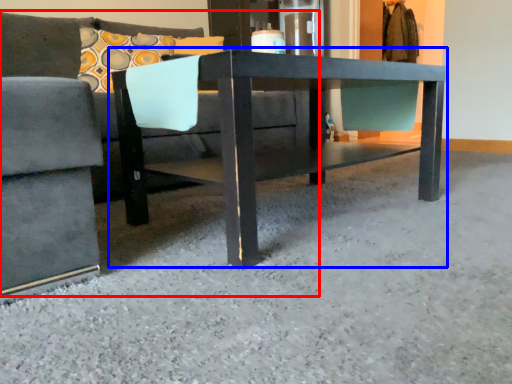
Question: Which object is closer to the camera taking this photo, studio couch (highlighted by a red box) or table (highlighted by a blue box)?

Choices:
 (A) studio couch
 (B) table

Answer: (A)